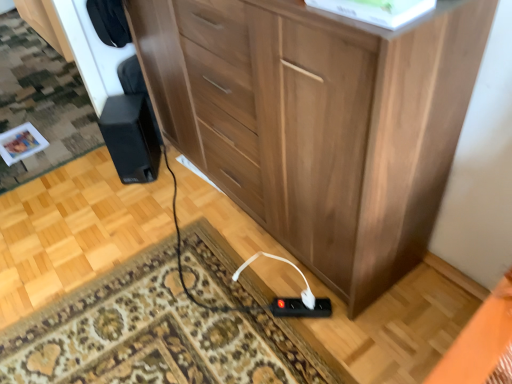
Question: In which direction should I rotate to look at black plastic power strip at lower center, which is counted as the 2th plug, starting from the right?

Choices:
 (A) left
 (B) right

Answer: (B)

Question: Is black plastic power strip at lower center, positioned as the first plug in left-to-right order, located outside white plastic plug at lower center, positioned as the second plug in left-to-right order?

Choices:
 (A) no
 (B) yes

Answer: (B)

Question: From a real-world perspective, is black plastic power strip at lower center, positioned as the first plug in left-to-right order, beneath white plastic plug at lower center, positioned as the second plug in left-to-right order?

Choices:
 (A) no
 (B) yes

Answer: (B)

Question: From a real-world perspective, is black plastic power strip at lower center, positioned as the first plug in left-to-right order, positioned over white plastic plug at lower center, positioned as the second plug in left-to-right order, based on gravity?

Choices:
 (A) yes
 (B) no

Answer: (B)

Question: Considering the relative sizes of black plastic power strip at lower center, positioned as the first plug in left-to-right order, and white plastic plug at lower center, positioned as the second plug in left-to-right order, in the image provided, is black plastic power strip at lower center, positioned as the first plug in left-to-right order, thinner than white plastic plug at lower center, positioned as the second plug in left-to-right order,?

Choices:
 (A) no
 (B) yes

Answer: (A)

Question: Could you tell me if black plastic power strip at lower center, which is counted as the 2th plug, starting from the right, is facing white plastic plug at lower center, positioned as the second plug in left-to-right order?

Choices:
 (A) no
 (B) yes

Answer: (A)

Question: Is black plastic power strip at lower center, which is counted as the 2th plug, starting from the right, bigger than white plastic plug at lower center, positioned as the second plug in left-to-right order?

Choices:
 (A) yes
 (B) no

Answer: (A)

Question: Would you consider black matte speaker at lower left to be distant from black plastic power strip at lower center, which is counted as the 2th plug, starting from the right?

Choices:
 (A) yes
 (B) no

Answer: (B)

Question: Is black matte speaker at lower left outside black plastic power strip at lower center, which is counted as the 2th plug, starting from the right?

Choices:
 (A) yes
 (B) no

Answer: (A)

Question: Is black matte speaker at lower left beside black plastic power strip at lower center, positioned as the first plug in left-to-right order?

Choices:
 (A) no
 (B) yes

Answer: (A)

Question: Is black matte speaker at lower left positioned with its back to black plastic power strip at lower center, positioned as the first plug in left-to-right order?

Choices:
 (A) no
 (B) yes

Answer: (A)

Question: Does black matte speaker at lower left appear on the right side of black plastic power strip at lower center, which is counted as the 2th plug, starting from the right?

Choices:
 (A) no
 (B) yes

Answer: (A)

Question: Is the depth of black matte speaker at lower left less than that of black plastic power strip at lower center, which is counted as the 2th plug, starting from the right?

Choices:
 (A) no
 (B) yes

Answer: (A)

Question: From a real-world perspective, is white plastic plug at lower center, positioned as the second plug in left-to-right order, on black plastic power strip at lower center, positioned as the first plug in left-to-right order?

Choices:
 (A) no
 (B) yes

Answer: (B)